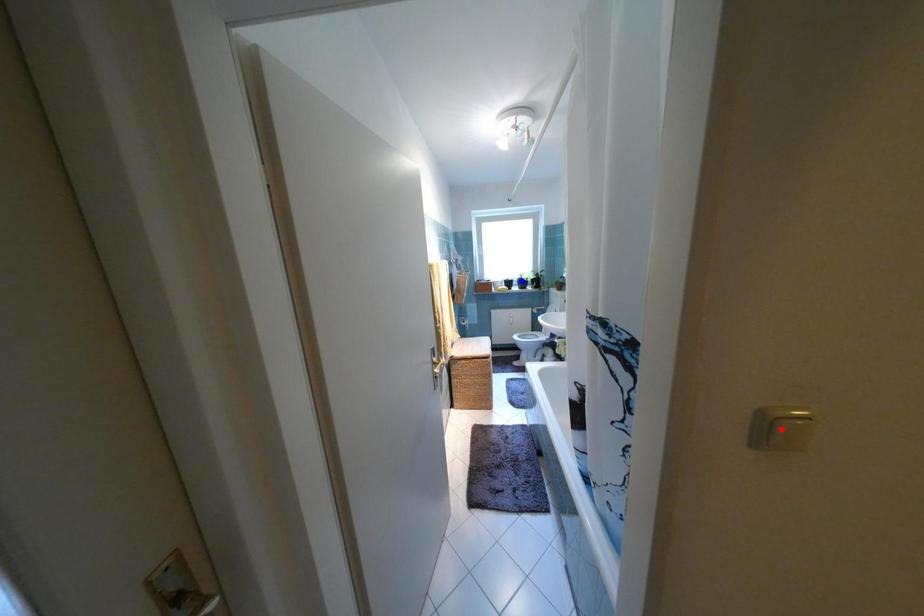
Question: In the image, two points are highlighted. Which point is nearer to the camera? Reply with the corresponding letter.

Choices:
 (A) blue point
 (B) red point

Answer: (B)